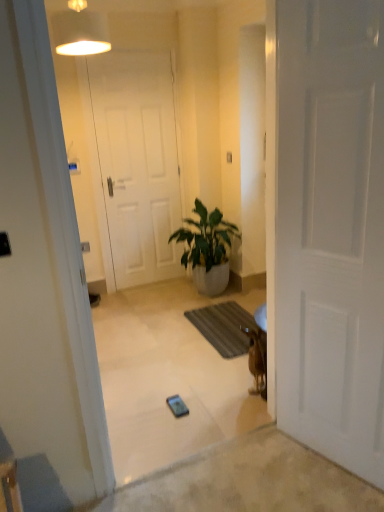
Question: Which direction should I rotate to look at white matte door at center, placed as the second door when sorted from back to front?

Choices:
 (A) left
 (B) right

Answer: (B)

Question: Considering the relative sizes of white fabric lampshade at upper center and green glossy plant at center in the image provided, is white fabric lampshade at upper center shorter than green glossy plant at center?

Choices:
 (A) yes
 (B) no

Answer: (A)

Question: From a real-world perspective, is white fabric lampshade at upper center located beneath green glossy plant at center?

Choices:
 (A) yes
 (B) no

Answer: (B)

Question: From the image's perspective, would you say white fabric lampshade at upper center is shown under green glossy plant at center?

Choices:
 (A) no
 (B) yes

Answer: (A)

Question: Can you confirm if white fabric lampshade at upper center is positioned to the left of green glossy plant at center?

Choices:
 (A) yes
 (B) no

Answer: (A)

Question: Considering the relative sizes of white fabric lampshade at upper center and green glossy plant at center in the image provided, is white fabric lampshade at upper center bigger than green glossy plant at center?

Choices:
 (A) yes
 (B) no

Answer: (B)

Question: Is white fabric lampshade at upper center positioned far away from green glossy plant at center?

Choices:
 (A) no
 (B) yes

Answer: (B)

Question: From a real-world perspective, is metallic silver phone at center beneath white matte door at center, which ranks as the first door in left-to-right order?

Choices:
 (A) yes
 (B) no

Answer: (A)

Question: Is metallic silver phone at center facing away from white matte door at center, the second door positioned from the right?

Choices:
 (A) yes
 (B) no

Answer: (B)

Question: Can you confirm if metallic silver phone at center is smaller than white matte door at center, placed as the 2th door when sorted from front to back?

Choices:
 (A) no
 (B) yes

Answer: (B)

Question: Considering the relative sizes of metallic silver phone at center and white matte door at center, placed as the 2th door when sorted from front to back, in the image provided, is metallic silver phone at center wider than white matte door at center, placed as the 2th door when sorted from front to back,?

Choices:
 (A) yes
 (B) no

Answer: (A)

Question: Does metallic silver phone at center appear on the left side of white matte door at center, which ranks as the first door in left-to-right order?

Choices:
 (A) no
 (B) yes

Answer: (A)

Question: From a real-world perspective, is metallic silver phone at center physically above white matte door at center, the first door viewed from the back?

Choices:
 (A) no
 (B) yes

Answer: (A)

Question: Is white fabric lampshade at upper center taller than brown furry dog at right?

Choices:
 (A) yes
 (B) no

Answer: (B)